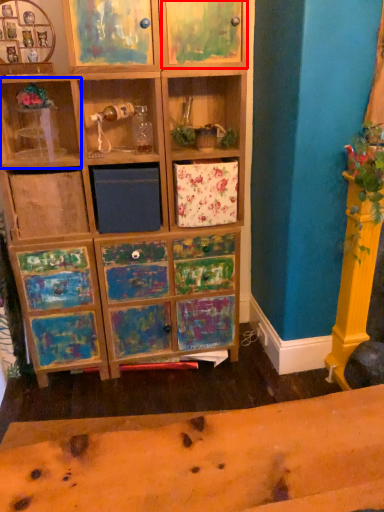
Question: Among these objects, which one is nearest to the camera, cabinet (highlighted by a red box) or shelf (highlighted by a blue box)?

Choices:
 (A) cabinet
 (B) shelf

Answer: (A)